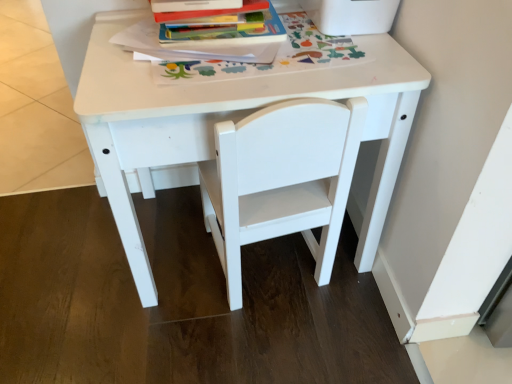
Question: Can you confirm if white matte chair at center is wider than white matte table at center?

Choices:
 (A) yes
 (B) no

Answer: (B)

Question: Does white matte chair at center have a greater height compared to white matte table at center?

Choices:
 (A) yes
 (B) no

Answer: (B)

Question: Is white matte chair at center placed right next to white matte table at center?

Choices:
 (A) no
 (B) yes

Answer: (A)

Question: Is white matte chair at center to the right of white matte table at center from the viewer's perspective?

Choices:
 (A) no
 (B) yes

Answer: (B)

Question: Is white matte chair at center smaller than white matte table at center?

Choices:
 (A) yes
 (B) no

Answer: (A)

Question: Relative to white matte table at center, is hardcover book at upper center in front or behind?

Choices:
 (A) front
 (B) behind

Answer: (B)

Question: Looking at their shapes, would you say hardcover book at upper center is wider or thinner than white matte table at center?

Choices:
 (A) wide
 (B) thin

Answer: (B)

Question: Which is correct: hardcover book at upper center is inside white matte table at center, or outside of it?

Choices:
 (A) outside
 (B) inside

Answer: (B)

Question: From a real-world perspective, relative to white matte table at center, is hardcover book at upper center vertically above or below?

Choices:
 (A) above
 (B) below

Answer: (A)

Question: Considering the positions of point (385, 92) and point (234, 54), is point (385, 92) closer or farther from the camera than point (234, 54)?

Choices:
 (A) closer
 (B) farther

Answer: (A)

Question: Is white matte table at center spatially inside hardcover book at upper center, or outside of it?

Choices:
 (A) outside
 (B) inside

Answer: (A)

Question: Considering the positions of white matte table at center and hardcover book at upper center in the image, is white matte table at center wider or thinner than hardcover book at upper center?

Choices:
 (A) thin
 (B) wide

Answer: (B)

Question: From a real-world perspective, relative to hardcover book at upper center, is white matte table at center vertically above or below?

Choices:
 (A) above
 (B) below

Answer: (B)

Question: Is hardcover book at upper center inside or outside of white matte chair at center?

Choices:
 (A) inside
 (B) outside

Answer: (B)

Question: Based on their sizes in the image, would you say hardcover book at upper center is bigger or smaller than white matte chair at center?

Choices:
 (A) small
 (B) big

Answer: (A)